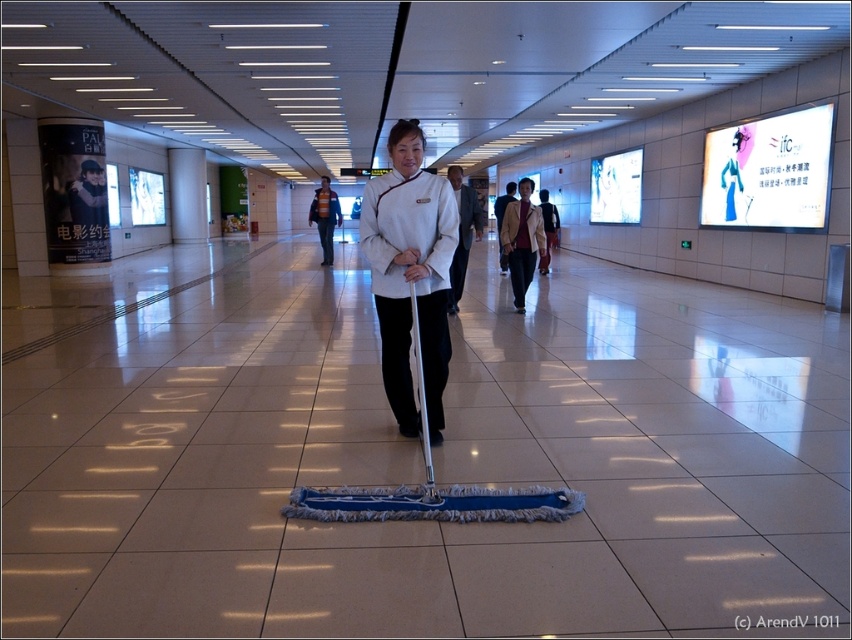
How much distance is there between white matte uniform at center and white fabric jacket at center?

white matte uniform at center is 14.35 feet away from white fabric jacket at center.

Find the location of `white matte uniform at center`. white matte uniform at center is located at coordinates (410, 273).

At what (x,y) coordinates should I click in order to perform the action: click on white matte uniform at center. Please return your answer as a coordinate pair (x, y). Looking at the image, I should click on (410, 273).

The height and width of the screenshot is (640, 852). In order to click on white matte uniform at center in this screenshot , I will do `click(410, 273)`.

Is white matte uniform at center below striped sweater at center?

Indeed, white matte uniform at center is positioned under striped sweater at center.

Can you confirm if white matte uniform at center is thinner than striped sweater at center?

Correct, white matte uniform at center's width is less than striped sweater at center's.

The height and width of the screenshot is (640, 852). I want to click on white matte uniform at center, so click(410, 273).

Where is `white fabric jacket at center`? white fabric jacket at center is located at coordinates (522, 241).